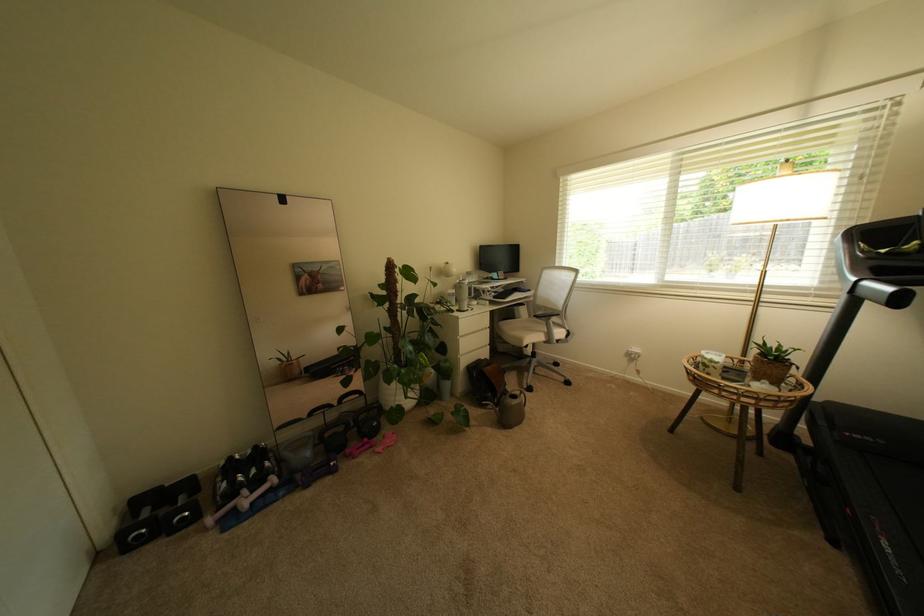
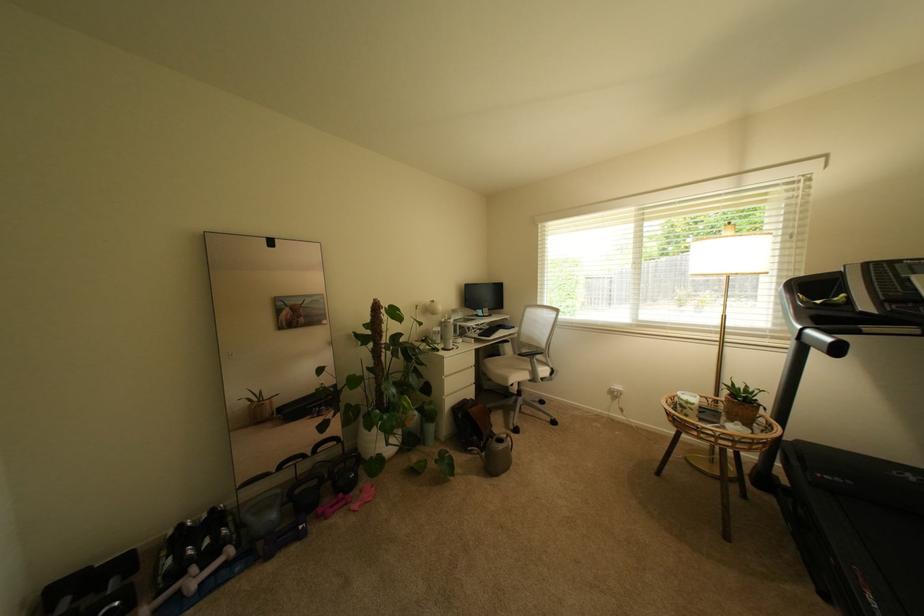
The point at (536,358) is marked in the first image. Where is the corresponding point in the second image?

(521, 395)